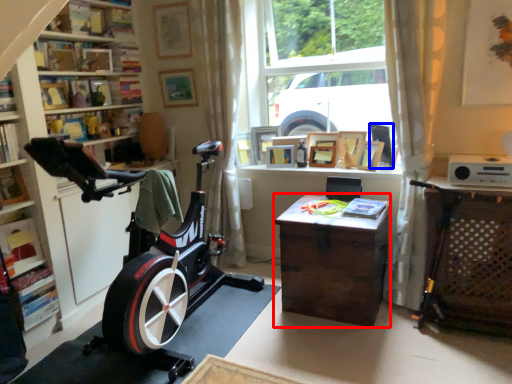
Question: Which point is further to the camera, desk (highlighted by a red box) or picture frame (highlighted by a blue box)?

Choices:
 (A) desk
 (B) picture frame

Answer: (B)